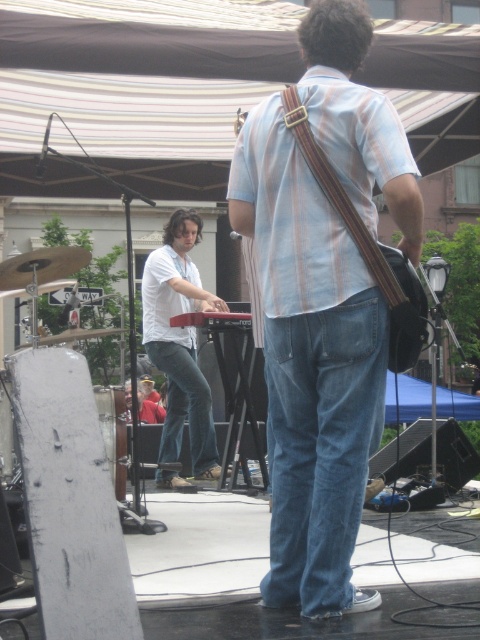
You are a photographer setting up a camera to capture the live music performance. The camera has a limited field of view. You want to ensure both the light blue striped shirt at center and the white matte keyboard at center are fully visible in the frame. Based on their positions and sizes, is there a risk that one of them might be partially cut off?

The light blue striped shirt at center might be wider than the white matte keyboard at center, so there is a risk that the light blue striped shirt at center could be partially cut off if the camera field of view is not adjusted to accommodate its width.

You are a photographer at the live music performance. You want to take a closeup shot of the matte brown guitar at center and the blue denim jeans at center. Which object should you zoom in on first to ensure it appears larger in your photo?

The matte brown guitar at center is closer to the viewer than the blue denim jeans at center, so you should zoom in on the matte brown guitar at center first to make it appear larger in the photo.